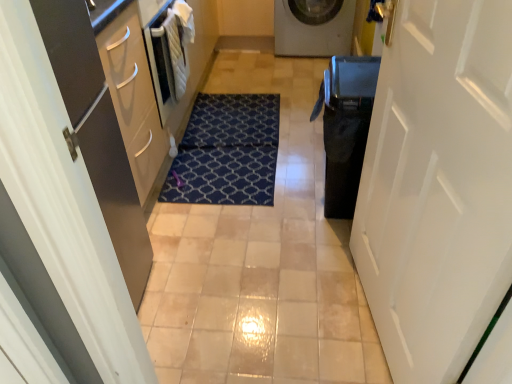
I want to click on vacant location below blue patterned mat at center (from a real-world perspective), so click(233, 139).